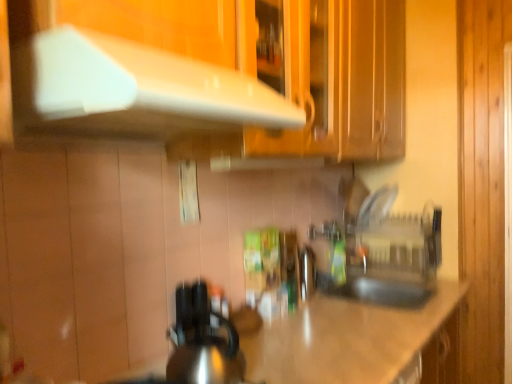
Question: Is the position of shiny metallic kettle at center more distant than that of white glossy exhaust hood at upper center?

Choices:
 (A) yes
 (B) no

Answer: (A)

Question: Is shiny metallic kettle at center closer to camera compared to white glossy exhaust hood at upper center?

Choices:
 (A) yes
 (B) no

Answer: (B)

Question: Is shiny metallic kettle at center to the right of white glossy exhaust hood at upper center from the viewer's perspective?

Choices:
 (A) no
 (B) yes

Answer: (B)

Question: Is shiny metallic kettle at center far away from white glossy exhaust hood at upper center?

Choices:
 (A) yes
 (B) no

Answer: (B)

Question: Is shiny metallic kettle at center outside white glossy exhaust hood at upper center?

Choices:
 (A) yes
 (B) no

Answer: (A)

Question: From the image's perspective, is shiny metallic kettle at center under white glossy exhaust hood at upper center?

Choices:
 (A) no
 (B) yes

Answer: (B)

Question: Is transparent plastic sink at center directly adjacent to shiny metallic kettle at center?

Choices:
 (A) no
 (B) yes

Answer: (A)

Question: Is transparent plastic sink at center closer to camera compared to shiny metallic kettle at center?

Choices:
 (A) no
 (B) yes

Answer: (A)

Question: Is transparent plastic sink at center surrounding shiny metallic kettle at center?

Choices:
 (A) no
 (B) yes

Answer: (A)

Question: Considering the relative positions of transparent plastic sink at center and shiny metallic kettle at center in the image provided, is transparent plastic sink at center to the left of shiny metallic kettle at center from the viewer's perspective?

Choices:
 (A) yes
 (B) no

Answer: (B)

Question: Does transparent plastic sink at center turn towards shiny metallic kettle at center?

Choices:
 (A) yes
 (B) no

Answer: (A)

Question: Is transparent plastic sink at center located outside shiny metallic kettle at center?

Choices:
 (A) yes
 (B) no

Answer: (A)

Question: From the image's perspective, is green matte bottle at center located above transparent plastic sink at center?

Choices:
 (A) no
 (B) yes

Answer: (A)